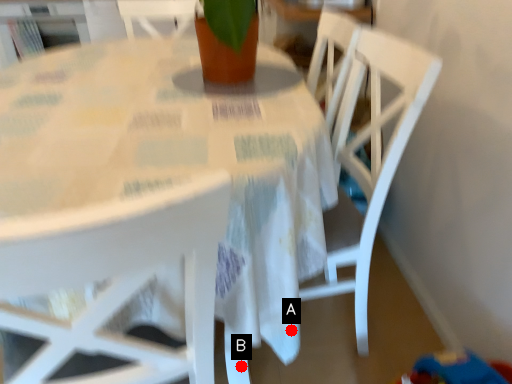
Question: Two points are circled on the image, labeled by A and B beside each circle. Which point is closer to the camera?

Choices:
 (A) A is closer
 (B) B is closer

Answer: (A)